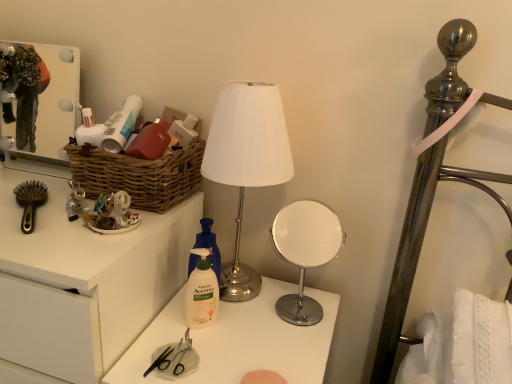
In order to click on free region on the left part of metallic silver scissors at center in this screenshot , I will do `click(138, 356)`.